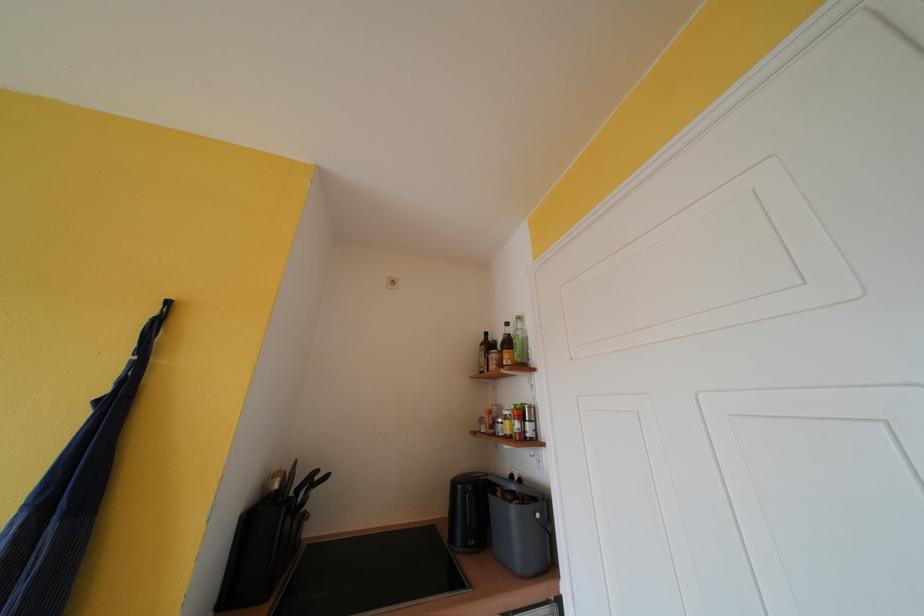
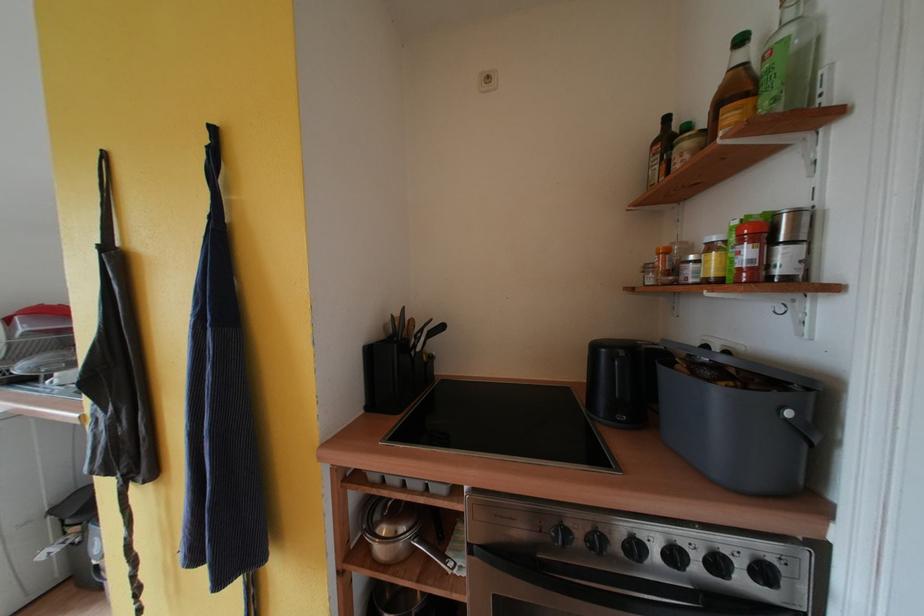
The point at (323, 475) is marked in the first image. Where is the corresponding point in the second image?

(436, 323)